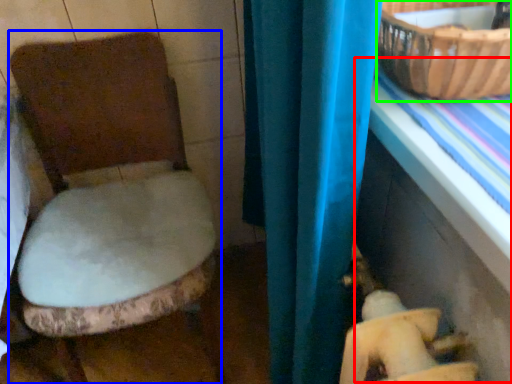
Question: Considering the real-world distances, which object is closest to table (highlighted by a red box)? toilet (highlighted by a blue box) or basket (highlighted by a green box).

Choices:
 (A) toilet
 (B) basket

Answer: (B)